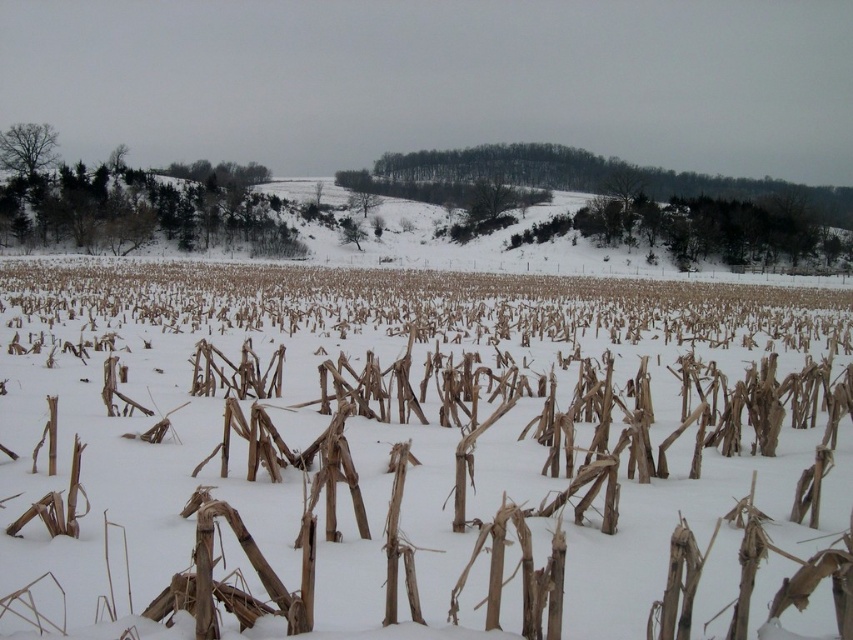
Looking at this image, which is more to the left, brown dry stalks at center or green leafy trees at left?

green leafy trees at left is more to the left.

Measure the distance between brown dry stalks at center and green leafy trees at left.

They are 26.96 meters apart.

Does point (837, 332) come behind point (38, 211)?

No, it is in front of (38, 211).

You are a GUI agent. You are given a task and a screenshot of the screen. Output one action in this format:
    pyautogui.click(x=<x>, y=<y>)
    Task: Click on the brown dry stalks at center
    The height and width of the screenshot is (640, 853).
    Given the screenshot: What is the action you would take?
    pyautogui.click(x=421, y=301)

Does green leafy trees at left have a smaller size compared to bare branches at upper left?

Actually, green leafy trees at left might be larger than bare branches at upper left.

Between point (103, 221) and point (51, 166), which one is positioned behind?

The point (51, 166) is behind.

Locate an element on the screen. Image resolution: width=853 pixels, height=640 pixels. green leafy trees at left is located at coordinates (131, 202).

Does brown dry stalks at center have a larger size compared to bare branches at upper left?

Correct, brown dry stalks at center is larger in size than bare branches at upper left.

Between brown dry stalks at center and bare branches at upper left, which one has less height?

brown dry stalks at center is shorter.

Is point (631, 323) less distant than point (15, 145)?

Yes, it is.

The image size is (853, 640). In order to click on brown dry stalks at center in this screenshot , I will do `click(421, 301)`.